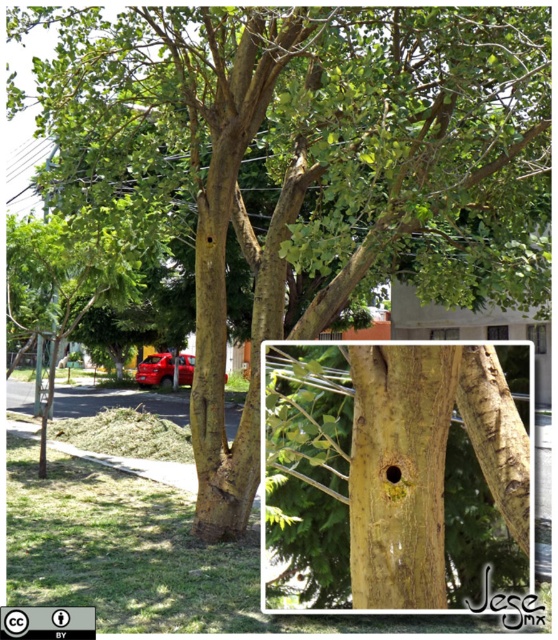
Who is positioned more to the right, yellow rough bark at center or glossy red car at center?

yellow rough bark at center is more to the right.

Which of these two, yellow rough bark at center or glossy red car at center, stands taller?

glossy red car at center

Does point (367, 598) lie in front of point (161, 356)?

Yes, it is.

At what (x,y) coordinates should I click in order to perform the action: click on yellow rough bark at center. Please return your answer as a coordinate pair (x, y). The width and height of the screenshot is (558, 640). Looking at the image, I should click on (401, 474).

Is yellow rough bark hole at center to the left of glossy red car at center from the viewer's perspective?

Incorrect, yellow rough bark hole at center is not on the left side of glossy red car at center.

Between yellow rough bark hole at center and glossy red car at center, which one is positioned higher?

yellow rough bark hole at center is higher up.

Image resolution: width=558 pixels, height=640 pixels. In order to click on yellow rough bark hole at center in this screenshot , I will do `click(401, 476)`.

The width and height of the screenshot is (558, 640). Identify the location of yellow rough bark hole at center. (401, 476).

Between yellow rough bark hole at center and yellow rough bark at center, which one is positioned higher?

yellow rough bark at center is higher up.

Between point (479, 520) and point (455, 349), which one is positioned in front?

Positioned in front is point (455, 349).

This screenshot has height=640, width=558. I want to click on yellow rough bark hole at center, so click(x=401, y=476).